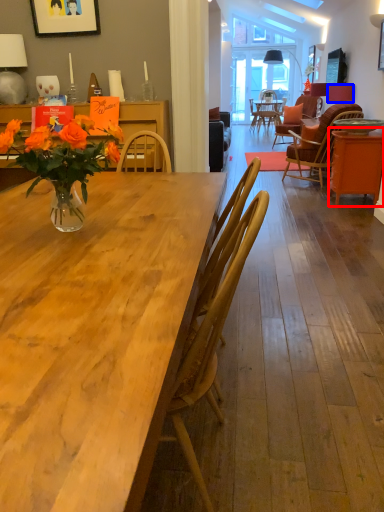
Question: Which of the following is the farthest to the observer, table (highlighted by a red box) or lamp (highlighted by a blue box)?

Choices:
 (A) table
 (B) lamp

Answer: (B)